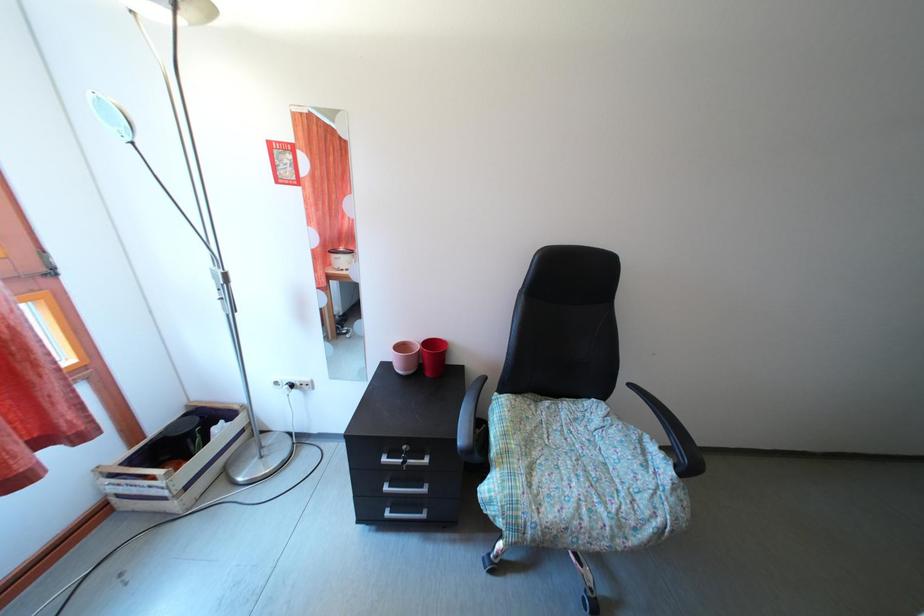
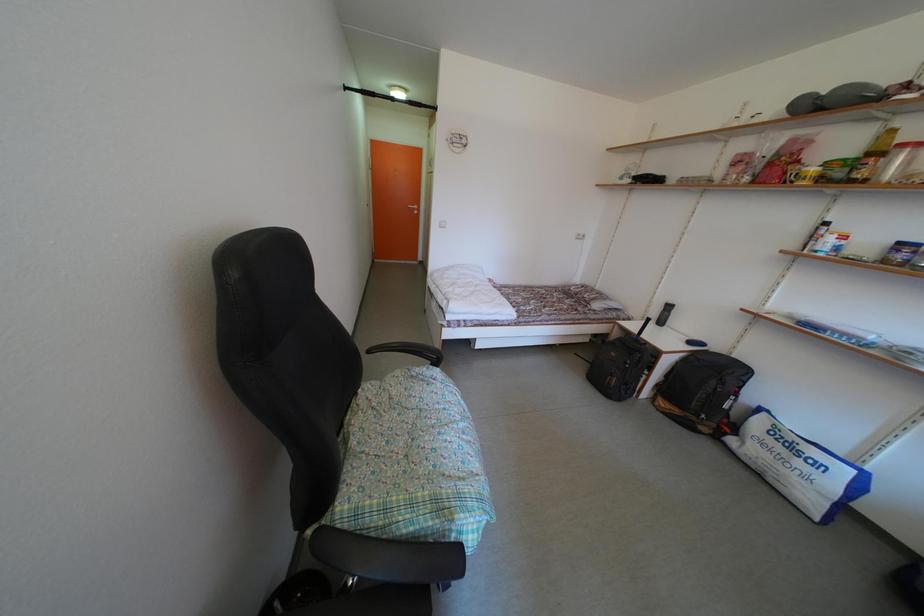
The first image is from the beginning of the video and the second image is from the end. How did the camera likely rotate when shooting the video?

The camera rotated toward right-down.